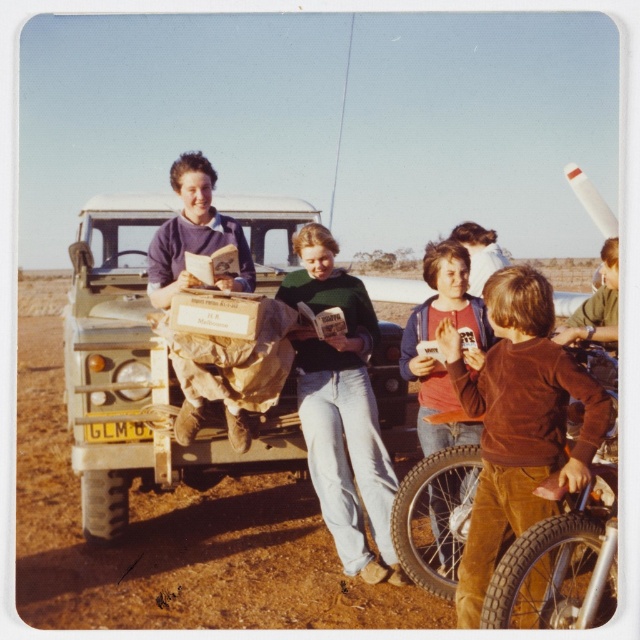
You are standing at the edge of the scene and want to walk towards the brown corduroy pants at lower right. Which direction should you head relative to the light green matte truck at center?

The light green matte truck at center is to the left of the brown corduroy pants at lower right, so you should head to the right of the light green matte truck at center to reach the brown corduroy pants at lower right.

You are a photographer trying to capture a photo of the light green matte truck at center and the brown corduroy pants at lower right. Since you want both subjects to be clearly visible, will the truck block the view of the pants?

The light green matte truck at center is taller than the brown corduroy pants at lower right. Therefore, the truck might block the view of the pants if positioned between the camera and the pants.